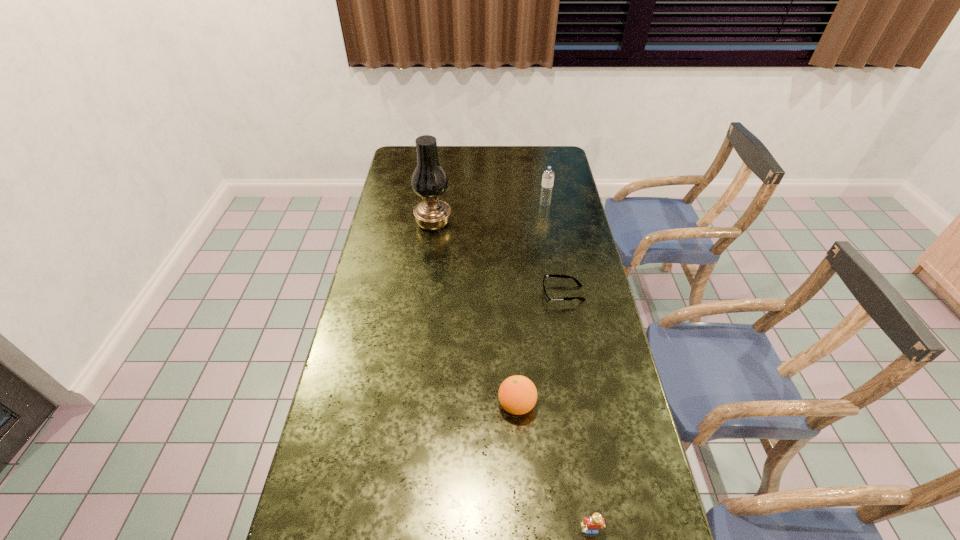
Where is `the tallest object`? This screenshot has width=960, height=540. the tallest object is located at coordinates (429, 181).

Locate an element on the screen. the second farthest object is located at coordinates (429, 181).

You are a GUI agent. You are given a task and a screenshot of the screen. Output one action in this format:
    pyautogui.click(x=<x>, y=<y>)
    Task: Click on the water bottle
    This screenshot has width=960, height=540.
    Given the screenshot: What is the action you would take?
    pyautogui.click(x=548, y=175)

Where is `the farthest object`? The image size is (960, 540). the farthest object is located at coordinates (548, 175).

This screenshot has width=960, height=540. Find the location of `the fourth farthest object`. the fourth farthest object is located at coordinates (517, 394).

Where is `orange`? This screenshot has height=540, width=960. orange is located at coordinates pos(517,394).

You are a GUI agent. You are given a task and a screenshot of the screen. Output one action in this format:
    pyautogui.click(x=<x>, y=<y>)
    Task: Click on the fourth tallest object
    
    Given the screenshot: What is the action you would take?
    pyautogui.click(x=595, y=522)

Find the location of a particular element. Lego is located at coordinates (595, 522).

Locate an element on the screen. the third farthest object is located at coordinates (549, 275).

The image size is (960, 540). Find the location of `sunglasses`. sunglasses is located at coordinates (549, 275).